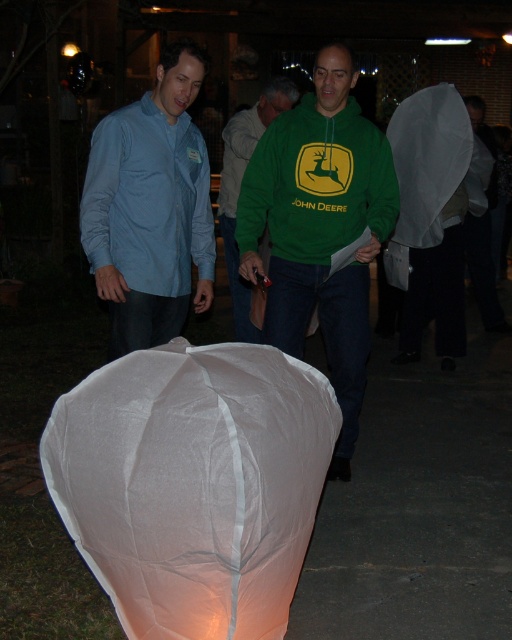
You are a photographer trying to capture the white paper lantern at center and the matte blue shirt at left in a single shot. Based on their positions, which object should you focus on first to ensure both are in sharp focus?

The white paper lantern at center is below matte blue shirt at left, so you should focus on the matte blue shirt at left first since it is closer to the camera. This will ensure the lantern, being further back, is still within the depth of field.

You are standing in the nighttime scene and want to hand a message strip to the person in the matte blue shirt at left. Since the white paper lantern at center is in the way, which direction should you move to reach the person without bumping into the lantern?

The white paper lantern at center is to the right of the matte blue shirt at left. To avoid the lantern, you should move to the left side of the white paper lantern at center to reach the matte blue shirt at left.

You are a photographer trying to capture a clear photo of both the green fleece at center and the matte blue shirt at left. Since the camera can only focus on one subject at a time, which subject should you focus on to ensure the other is still in the frame?

You should focus on the matte blue shirt at left because the green fleece at center is located below it, so focusing on the higher object ensures the lower one stays in the frame.